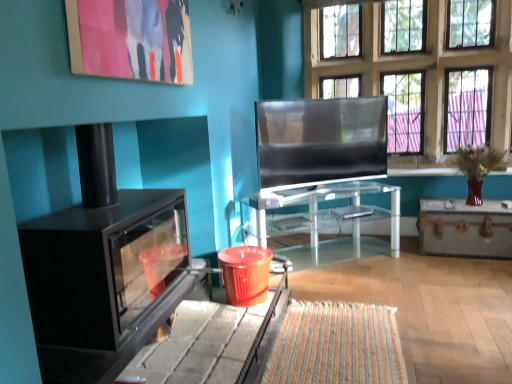
Question: Considering the positions of glass paneled window at upper center and transparent glass table at center, the second table positioned from the right, in the image, is glass paneled window at upper center taller or shorter than transparent glass table at center, the second table positioned from the right,?

Choices:
 (A) short
 (B) tall

Answer: (B)

Question: From the image's perspective, relative to transparent glass table at center, the second table positioned from the right, is glass paneled window at upper center above or below?

Choices:
 (A) below
 (B) above

Answer: (B)

Question: Which object is the farthest from the black matte fireplace at left?

Choices:
 (A) glass paneled window at upper center
 (B) matte acrylic painting at upper left
 (C) transparent glass table at center, the second table positioned from the right
 (D) matte black tv at center
 (E) metallic trunk at right, the second table when ordered from left to right

Answer: (A)

Question: Estimate the real-world distances between objects in this image. Which object is closer to the matte acrylic painting at upper left?

Choices:
 (A) matte black tv at center
 (B) glass paneled window at upper center
 (C) metallic trunk at right, the second table when ordered from left to right
 (D) black matte fireplace at left
 (E) transparent glass table at center, the second table positioned from the right

Answer: (D)